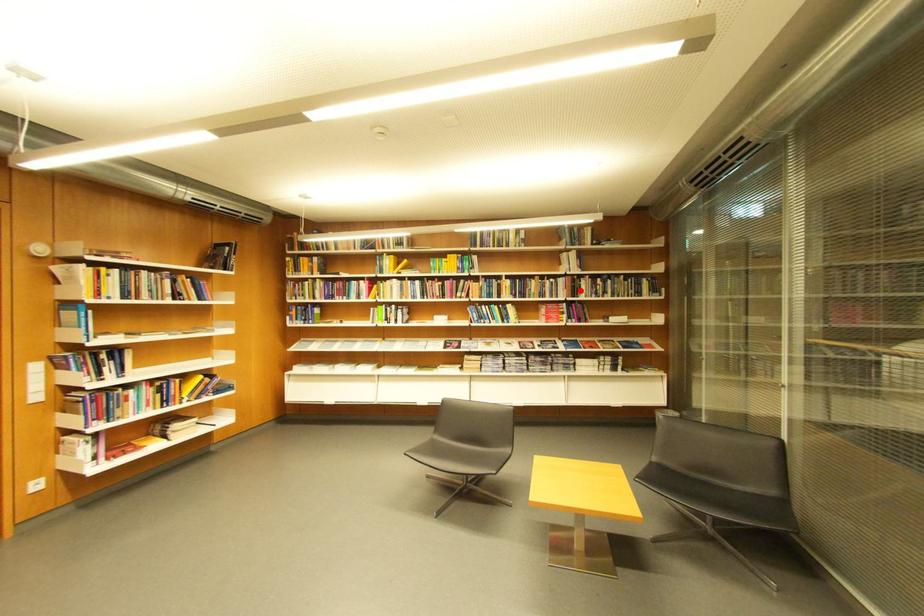
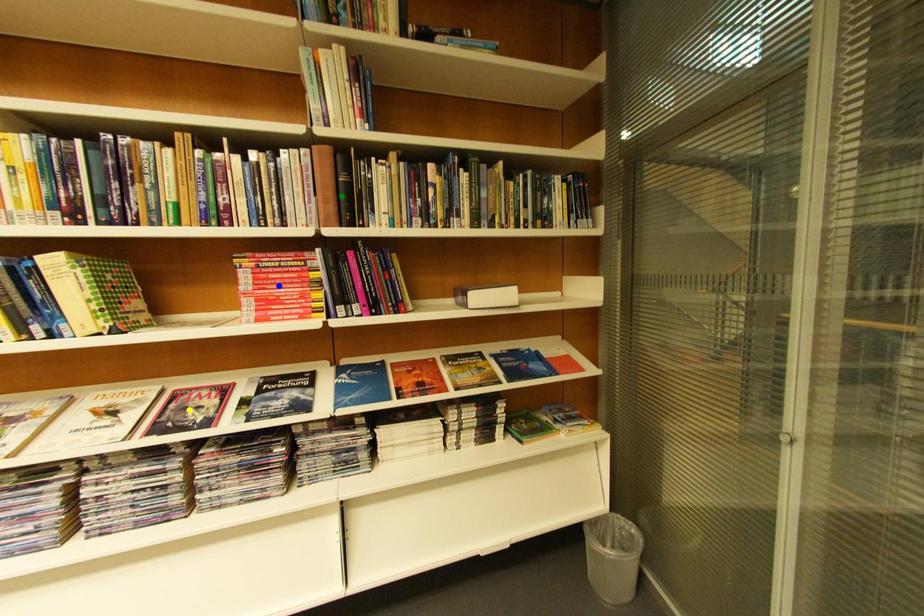
Question: I am providing you with two images of the same scene from different viewpoints. A red point is marked on the first image. You are given multiple points on the second image. Which point in image 2 represents the same 3d spot as the red point in image 1?

Choices:
 (A) blue point
 (B) yellow point
 (C) green point

Answer: (C)